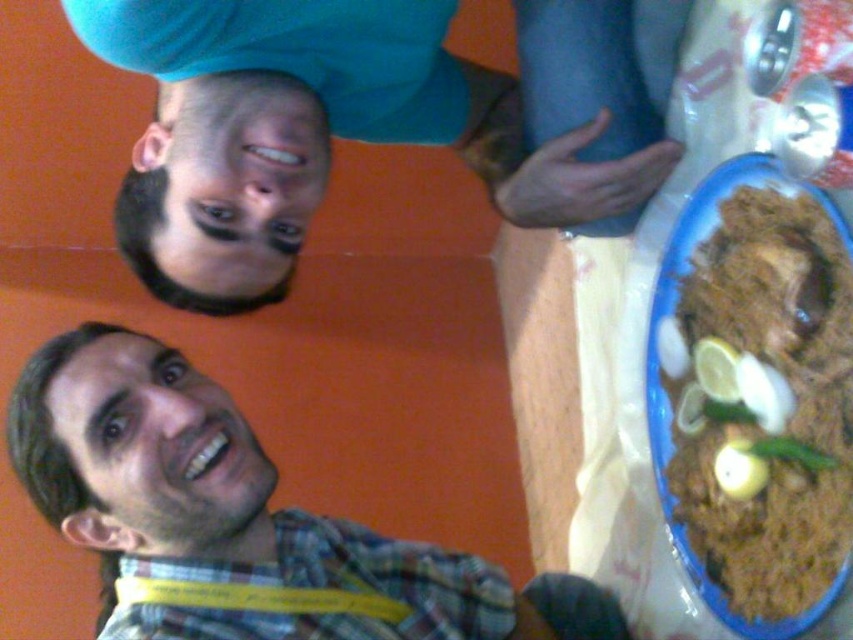
Which of these two, plaid shirt at lower left or brown matte rice at right, stands shorter?

With less height is brown matte rice at right.

Is plaid shirt at lower left above brown matte rice at right?

Actually, plaid shirt at lower left is below brown matte rice at right.

Which is in front, point (160, 634) or point (778, 284)?

Point (160, 634) is more forward.

Find the location of a particular element. This screenshot has height=640, width=853. plaid shirt at lower left is located at coordinates (236, 518).

Does point (651, 145) come in front of point (363, 602)?

No, (651, 145) is further to viewer.

Is blue fabric shirt at upper center taller than plaid shirt at lower left?

Incorrect, blue fabric shirt at upper center's height is not larger of plaid shirt at lower left's.

The width and height of the screenshot is (853, 640). Describe the element at coordinates (370, 122) in the screenshot. I see `blue fabric shirt at upper center` at that location.

At what (x,y) coordinates should I click in order to perform the action: click on blue fabric shirt at upper center. Please return your answer as a coordinate pair (x, y). Looking at the image, I should click on (370, 122).

At what (x,y) coordinates should I click in order to perform the action: click on blue fabric shirt at upper center. Please return your answer as a coordinate pair (x, y). The height and width of the screenshot is (640, 853). Looking at the image, I should click on (370, 122).

Between blue fabric shirt at upper center and brown matte rice at right, which one is positioned lower?

brown matte rice at right

Identify the location of blue fabric shirt at upper center. This screenshot has width=853, height=640. (370, 122).